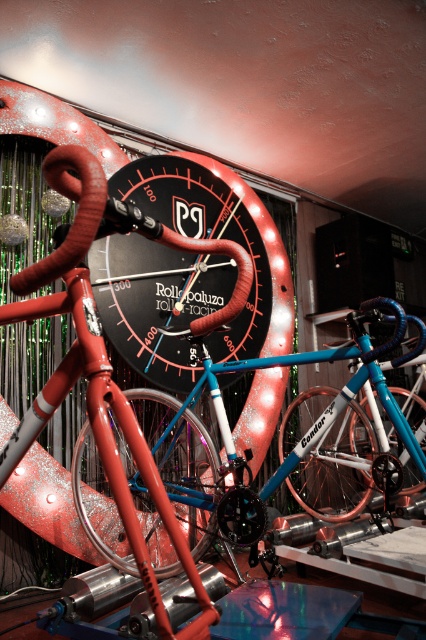
You are a visitor at the exhibition and want to take a photo of both the shiny blue frame bicycle at center and the metallic black clock at center. Which object should you position to your left side to include both in the frame?

You should position the metallic black clock at center to your left side because the shiny blue frame bicycle at center is to the right of it, so placing the clock on your left will allow both objects to be captured in the photo.

You are a visitor at an art exhibition and see the shiny blue frame bicycle at center and the metallic black clock at center. Which object is closer to you?

The shiny blue frame bicycle at center is closer to you because it is in front of the metallic black clock at center.

You are a visitor at the exhibition and want to take a photo of both the shiny blue frame bicycle at center and the metallic black clock at center. Which object should you focus on first to ensure both are in the frame?

You should focus on the metallic black clock at center first since the shiny blue frame bicycle at center is located below it, ensuring both are in the frame by starting with the higher positioned object.